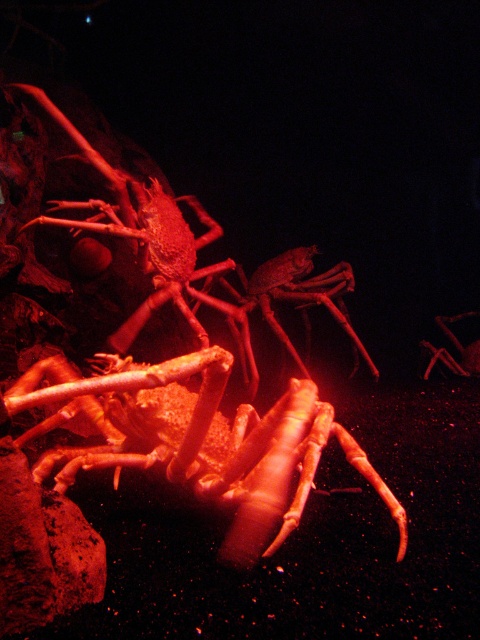
Between matte orange lobster at center and smooth red lobster at center, which one has less height?

Standing shorter between the two is matte orange lobster at center.

Is matte orange lobster at center smaller than smooth red lobster at center?

Indeed, matte orange lobster at center has a smaller size compared to smooth red lobster at center.

Who is more forward, (x=287, y=536) or (x=299, y=301)?

Point (x=287, y=536) is more forward.

Image resolution: width=480 pixels, height=640 pixels. I want to click on matte orange lobster at center, so click(x=197, y=440).